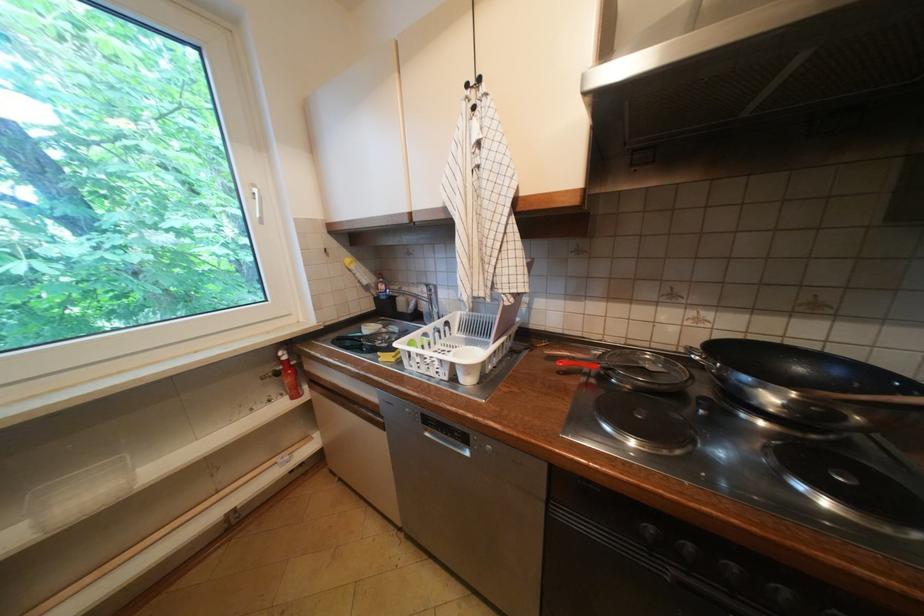
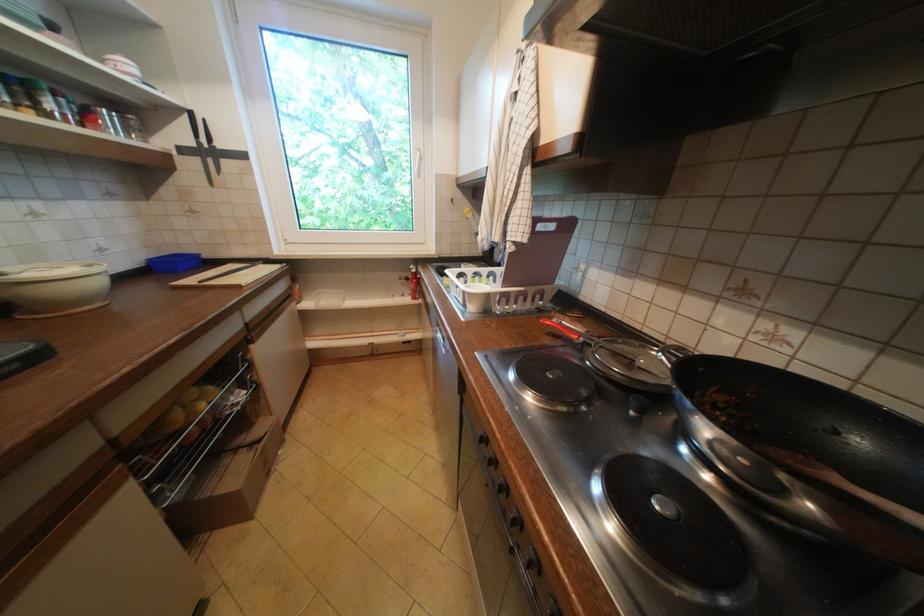
Find the pixel in the second image that matches the point at 779,400 in the first image.

(715, 430)